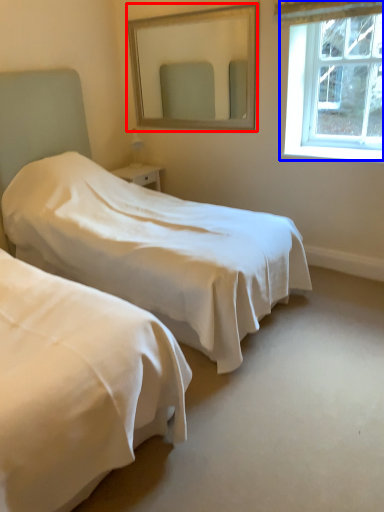
Question: Which object is closer to the camera taking this photo, mirror (highlighted by a red box) or window (highlighted by a blue box)?

Choices:
 (A) mirror
 (B) window

Answer: (B)